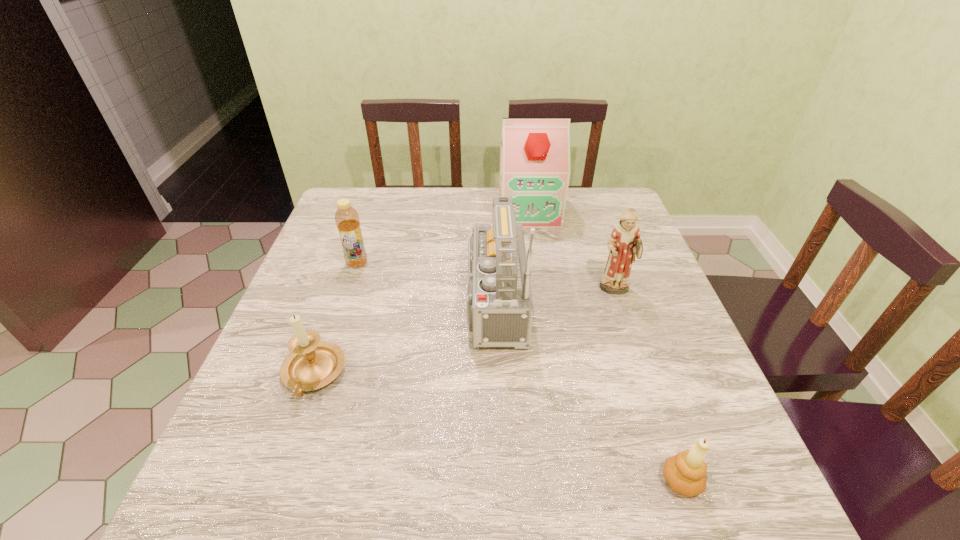
You are a GUI agent. You are given a task and a screenshot of the screen. Output one action in this format:
    pyautogui.click(x=<x>, y=<y>)
    Task: Click on the figurine at the right edge
    
    Given the screenshot: What is the action you would take?
    pyautogui.click(x=624, y=244)

Where is `candle_holder situated at the right edge`? candle_holder situated at the right edge is located at coordinates (685, 472).

The height and width of the screenshot is (540, 960). What are the coordinates of `object that is at the near right corner` in the screenshot? It's located at (685, 472).

In the image, there is a desktop. Identify the location of vacant space at the near edge. (442, 494).

Where is `free space at the left edge of the desktop`? free space at the left edge of the desktop is located at coordinates coord(325,318).

The image size is (960, 540). Find the location of `free space at the right edge of the desktop`. free space at the right edge of the desktop is located at coordinates (662, 462).

The width and height of the screenshot is (960, 540). In the image, there is a desktop. Identify the location of vacant area at the far right corner. (577, 205).

Locate an element on the screen. The image size is (960, 540). free space between the radio receiver and the nearest object is located at coordinates (584, 392).

At what (x,y) coordinates should I click in order to perform the action: click on free space between the third shortest object and the radio receiver. Please return your answer as a coordinate pair (x, y). This screenshot has height=540, width=960. Looking at the image, I should click on (421, 283).

Where is `empty space that is in between the nearer candle_holder and the fourth shortest object`? The width and height of the screenshot is (960, 540). empty space that is in between the nearer candle_holder and the fourth shortest object is located at coordinates (648, 386).